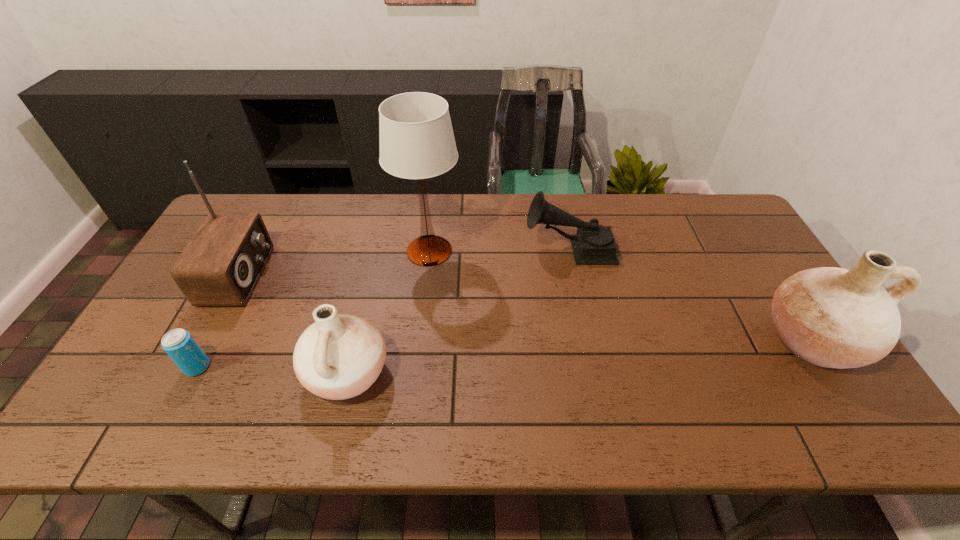
What are the coordinates of `object that is the second nearest to the second object from right to left` in the screenshot? It's located at (x=831, y=317).

Identify the location of free spot that satisfies the following two spatial constraints: 1. on the front-facing side of the soda can; 2. on the left side of the radio receiver. (191, 367).

In order to click on vacant area that satisfies the following two spatial constraints: 1. on the front-facing side of the radio receiver; 2. on the left side of the shortest object in this screenshot , I will do `click(191, 367)`.